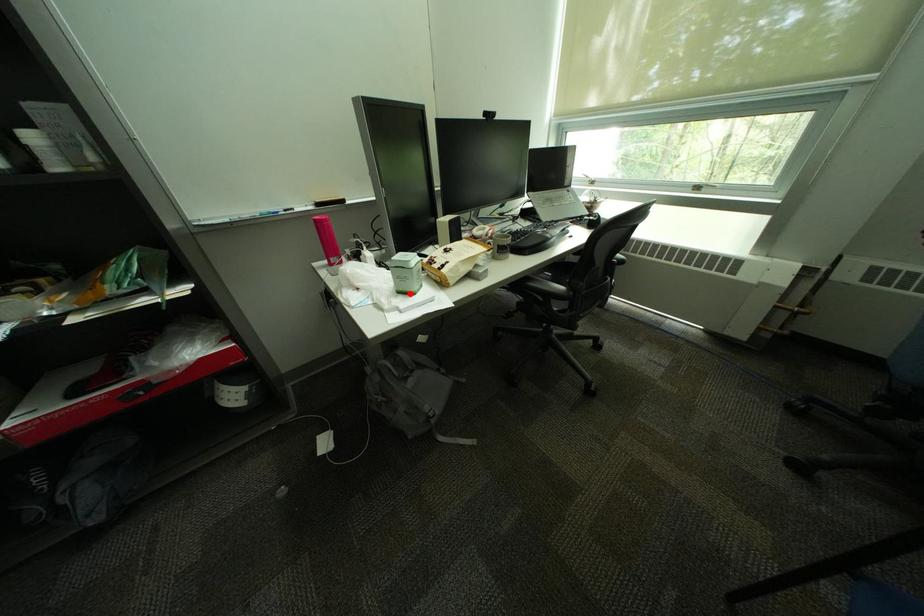
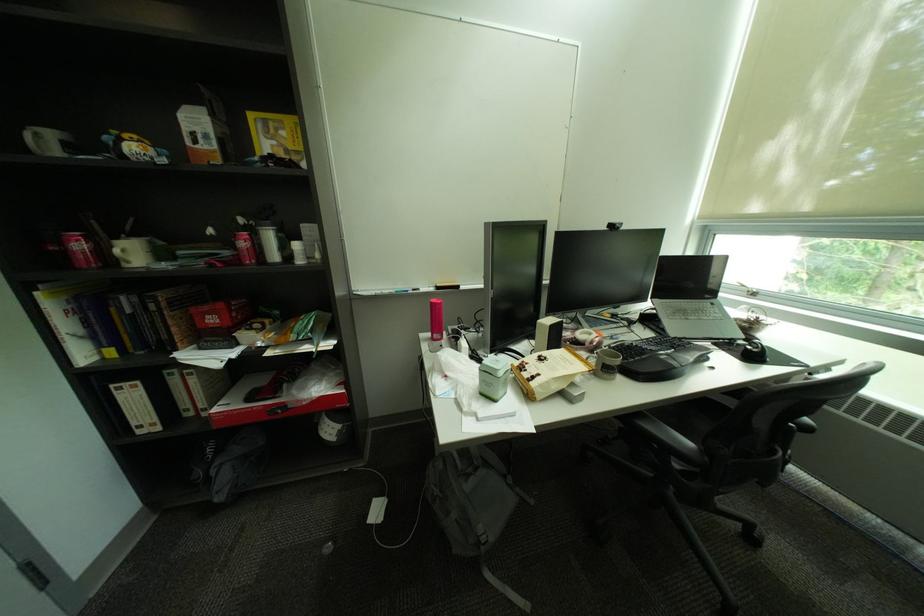
Find the pixel in the second image that matches the highlighted location in the first image.

(492, 395)